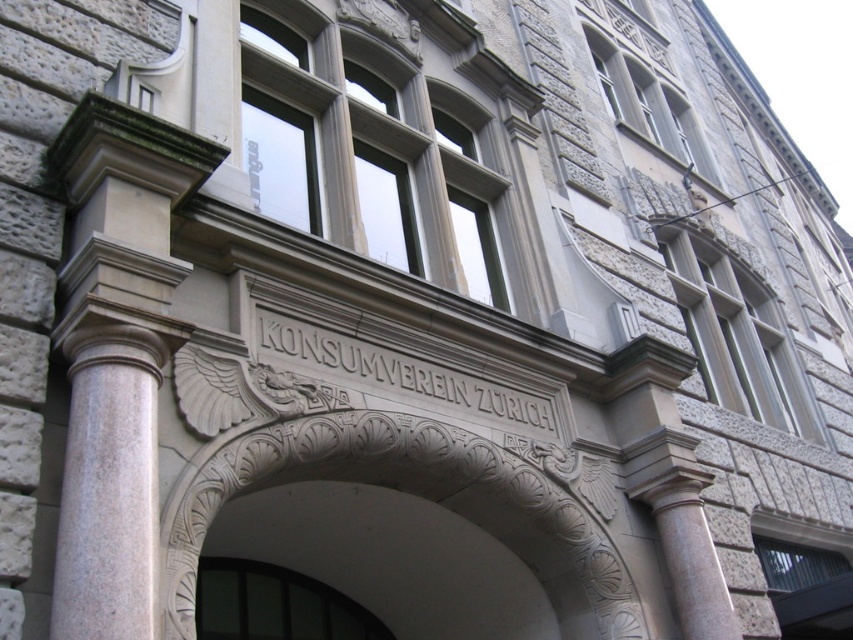
You are an architect assessing the distance between the gray stone window at upper right and the transparent glass door at center for a renovation project. Given that the minimum required distance for safety regulations is 25 feet, is the current spacing compliant?

The gray stone window at upper right and transparent glass door at center are 27.27 feet apart, which exceeds the minimum required distance of 25 feet for safety regulations. Therefore, the current spacing is compliant.

Consider the image. You are standing in front of the building and see the point at coordinates [274,604]. What is this point located on?

The point at coordinates [274,604] is located on the transparent glass door at center.

You are a visitor approaching the building and want to enter through the transparent glass door at center. Which direction should you look relative to the stone textured window at upper center to find the entrance?

The transparent glass door at center is located below the stone textured window at upper center, so you should look downward from the stone textured window at upper center to find the entrance.